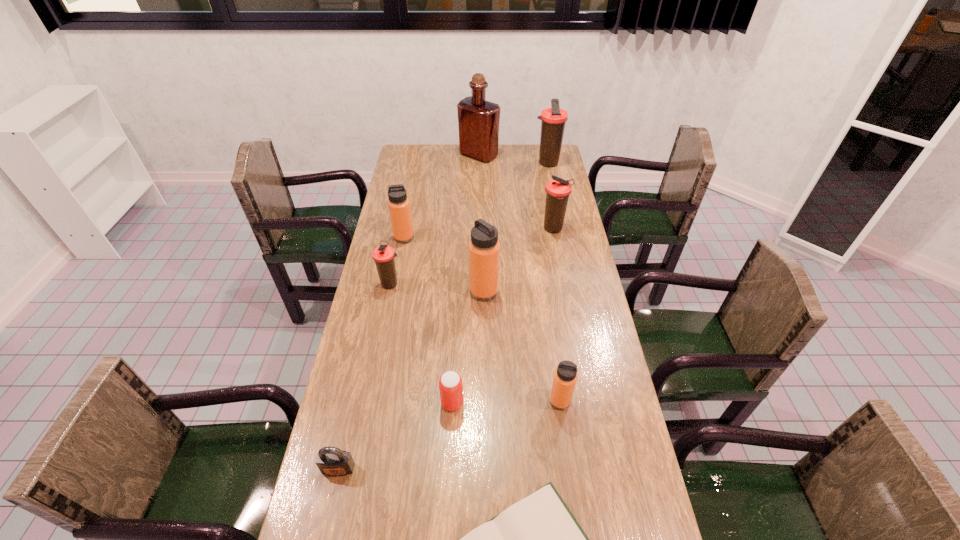
This screenshot has height=540, width=960. Find the location of `free space located 0.240m on the back of the leftmost orange thermos bottle`. free space located 0.240m on the back of the leftmost orange thermos bottle is located at coordinates (412, 197).

Image resolution: width=960 pixels, height=540 pixels. In order to click on vacant space located 0.170m on the back of the nearest brown thermos bottle in this screenshot , I will do `click(398, 245)`.

The height and width of the screenshot is (540, 960). I want to click on free space located 0.220m on the back of the smallest orange thermos bottle, so click(550, 330).

The image size is (960, 540). Identify the location of free space located 0.290m on the left of the beer can. (337, 403).

This screenshot has width=960, height=540. What are the coordinates of `free space located 0.080m on the front of the padlock near the keyhole` in the screenshot? It's located at (328, 512).

I want to click on liquor at the far edge, so click(x=478, y=120).

Locate an element on the screen. This screenshot has height=540, width=960. thermos bottle present at the far edge is located at coordinates (553, 119).

Identify the location of padlock present at the left edge. (332, 461).

The width and height of the screenshot is (960, 540). Find the location of `object that is at the far right corner`. object that is at the far right corner is located at coordinates (553, 119).

Identify the location of vacant space at the far edge of the desktop. This screenshot has width=960, height=540. (502, 160).